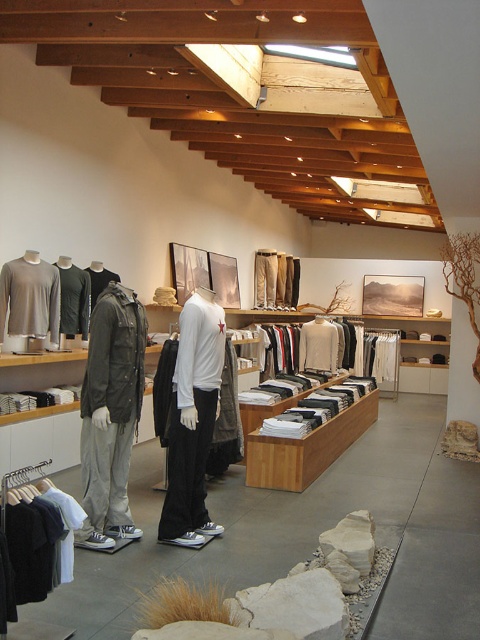
What do you see at coordinates (319, 346) in the screenshot? I see `white matte t-shirt at center` at bounding box center [319, 346].

Which is more to the right, white matte t-shirt at center or dark gray wool jacket at center?

white matte t-shirt at center is more to the right.

Identify the location of white matte t-shirt at center. (319, 346).

Which is more to the left, white matte long-sleeve shirt at center or dark gray wool jacket at center?

From the viewer's perspective, dark gray wool jacket at center appears more on the left side.

Does white matte long-sleeve shirt at center have a greater width compared to dark gray wool jacket at center?

Correct, the width of white matte long-sleeve shirt at center exceeds that of dark gray wool jacket at center.

Which is in front, point (211, 429) or point (94, 298)?

Point (211, 429) is more forward.

The height and width of the screenshot is (640, 480). Identify the location of white matte long-sleeve shirt at center. (192, 420).

Does matte gray long-sleeve shirt at center have a greater width compared to matte green t-shirt at center?

Yes, matte gray long-sleeve shirt at center is wider than matte green t-shirt at center.

Does matte gray long-sleeve shirt at center appear on the left side of matte green t-shirt at center?

Correct, you'll find matte gray long-sleeve shirt at center to the left of matte green t-shirt at center.

Who is more distant from viewer, (4, 291) or (75, 278)?

The point (75, 278) is behind.

Identify the location of matte gray long-sleeve shirt at center. (29, 298).